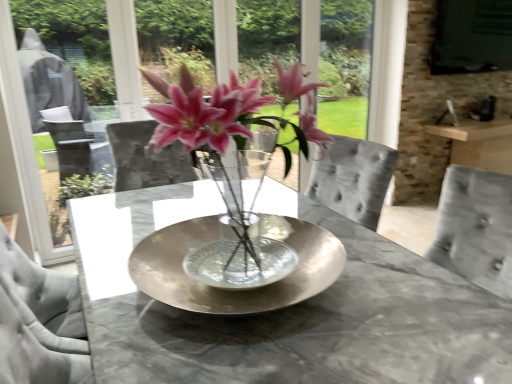
Question: Is pink glass vase at center at the back of metallic silver bowl at center?

Choices:
 (A) yes
 (B) no

Answer: (A)

Question: From a real-world perspective, does metallic silver bowl at center stand above pink glass vase at center?

Choices:
 (A) no
 (B) yes

Answer: (A)

Question: Considering the relative sizes of metallic silver bowl at center and pink glass vase at center in the image provided, is metallic silver bowl at center thinner than pink glass vase at center?

Choices:
 (A) no
 (B) yes

Answer: (A)

Question: Is the depth of metallic silver bowl at center less than that of pink glass vase at center?

Choices:
 (A) no
 (B) yes

Answer: (A)

Question: Would you consider metallic silver bowl at center to be distant from pink glass vase at center?

Choices:
 (A) no
 (B) yes

Answer: (A)

Question: Is pink glass vase at center to the left or to the right of black matte window screen at upper right in the image?

Choices:
 (A) right
 (B) left

Answer: (B)

Question: Is pink glass vase at center taller or shorter than black matte window screen at upper right?

Choices:
 (A) tall
 (B) short

Answer: (B)

Question: Is point (202, 127) positioned closer to the camera than point (506, 21)?

Choices:
 (A) closer
 (B) farther

Answer: (A)

Question: In terms of width, does pink glass vase at center look wider or thinner when compared to black matte window screen at upper right?

Choices:
 (A) wide
 (B) thin

Answer: (A)

Question: In terms of width, does metallic silver bowl at center look wider or thinner when compared to pink glass vase at center?

Choices:
 (A) thin
 (B) wide

Answer: (B)

Question: Based on their positions, is metallic silver bowl at center located to the left or right of pink glass vase at center?

Choices:
 (A) left
 (B) right

Answer: (B)

Question: Looking at the image, does metallic silver bowl at center seem bigger or smaller compared to pink glass vase at center?

Choices:
 (A) small
 (B) big

Answer: (A)

Question: Considering the positions of metallic silver bowl at center and pink glass vase at center in the image, is metallic silver bowl at center taller or shorter than pink glass vase at center?

Choices:
 (A) tall
 (B) short

Answer: (B)

Question: From the image's perspective, is black matte window screen at upper right positioned above or below metallic silver bowl at center?

Choices:
 (A) above
 (B) below

Answer: (A)

Question: Is black matte window screen at upper right inside the boundaries of metallic silver bowl at center, or outside?

Choices:
 (A) inside
 (B) outside

Answer: (B)